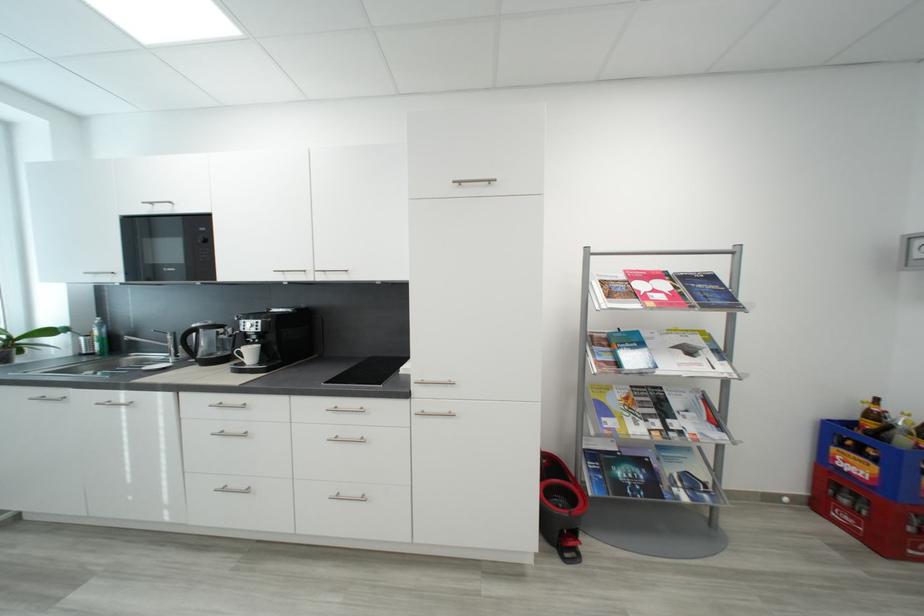
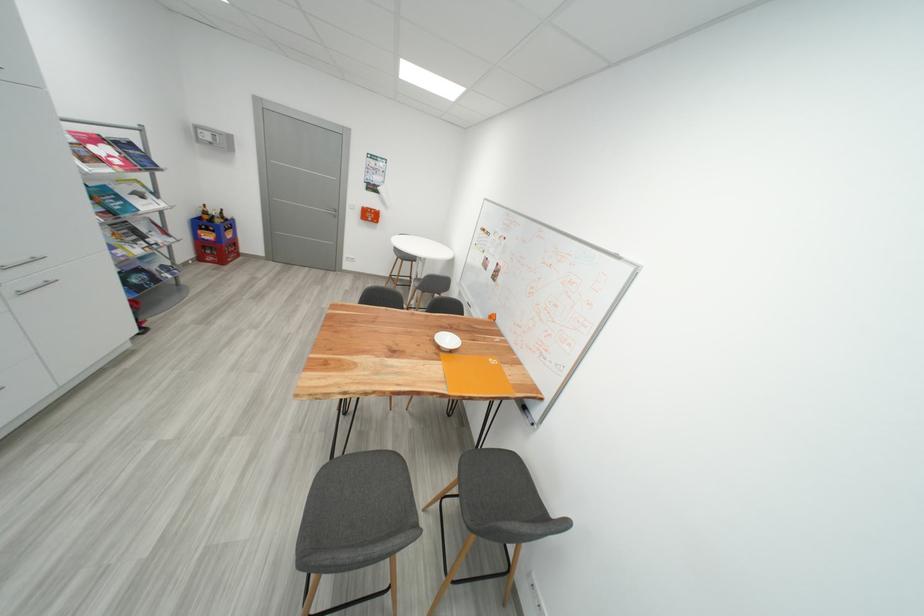
In the second image, find the point that corresponds to the point at 435,411 in the first image.

(30, 291)